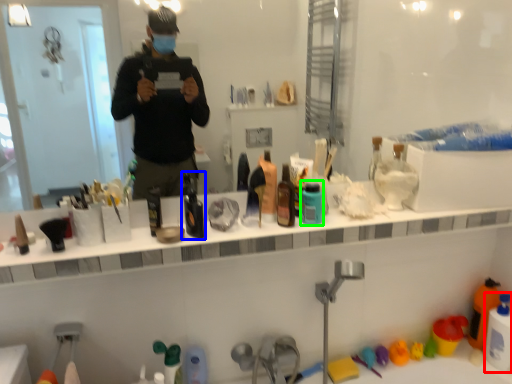
Question: Which object is the farthest from cleaning product (highlighted by a red box)? Choose among these: bottle (highlighted by a blue box) or mouthwash (highlighted by a green box).

Choices:
 (A) bottle
 (B) mouthwash

Answer: (A)